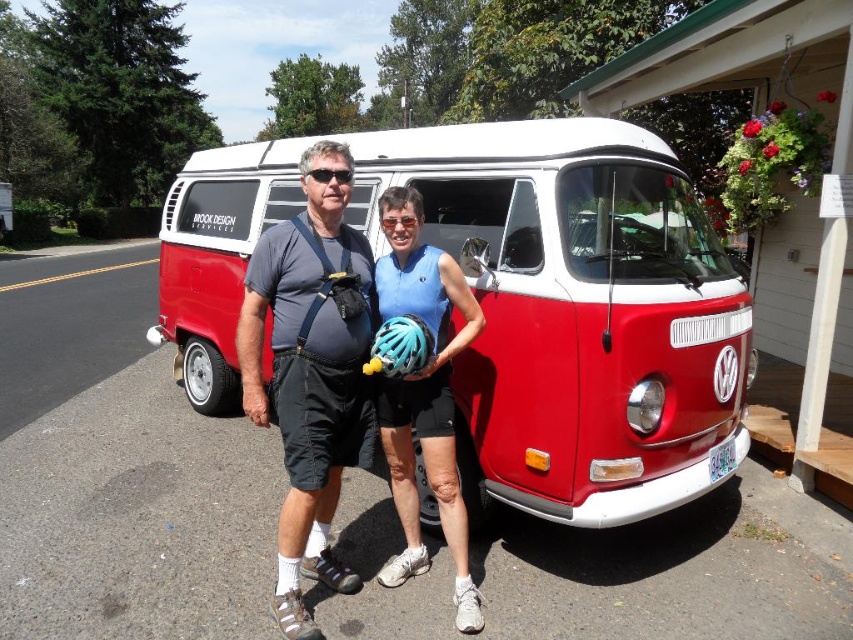
You are a photographer at the scene and want to capture both the blue matte helmet at center and the teal matte bicycle helmet at center in a single shot. Which helmet should you focus on first to ensure both are in frame?

The blue matte helmet at center is positioned under the teal matte bicycle helmet at center, so focusing on the teal matte bicycle helmet at center first would allow the blue matte helmet at center to naturally come into frame below it.

You are a photographer trying to capture a clear shot of the red matte van at center and the blue matte helmet at center. Since the van is taller than the helmet, you need to adjust your camera angle. Which object should you focus on first if you want to ensure both are fully visible in the frame?

The red matte van at center is shorter than the blue matte helmet at center. To ensure both are fully visible, focus on the taller blue matte helmet at center first, then adjust the angle to include the shorter van.

You are standing at the edge of a parking lot and see the red matte van at center. If you want to take a photo of the van from a distance of exactly 5 meters, should you move closer or farther away?

The red matte van at center is currently 5.46 meters away. To achieve a distance of exactly 5 meters, you should move closer by 0.46 meters.